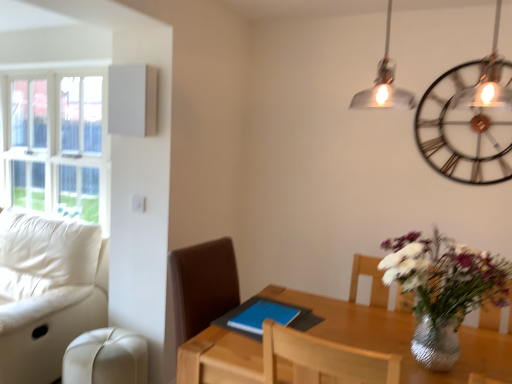
The width and height of the screenshot is (512, 384). What are the coordinates of `free point above beige leather swivel chair at lower left (from a real-world perspective)` in the screenshot? It's located at (103, 346).